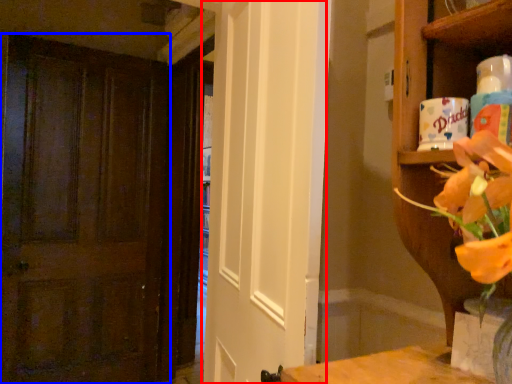
Question: Which point is closer to the camera, screen door (highlighted by a red box) or door (highlighted by a blue box)?

Choices:
 (A) screen door
 (B) door

Answer: (A)